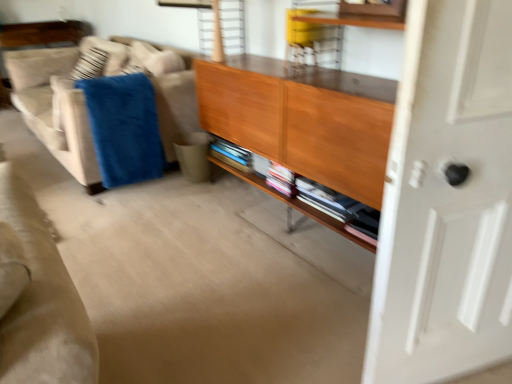
Question: From the image's perspective, does white glossy door at right appear lower than blue soft blanket at left?

Choices:
 (A) yes
 (B) no

Answer: (A)

Question: Could you tell me if white glossy door at right is facing blue soft blanket at left?

Choices:
 (A) no
 (B) yes

Answer: (A)

Question: Can you confirm if white glossy door at right is shorter than blue soft blanket at left?

Choices:
 (A) yes
 (B) no

Answer: (B)

Question: Does white glossy door at right appear on the left side of blue soft blanket at left?

Choices:
 (A) yes
 (B) no

Answer: (B)

Question: Is white glossy door at right surrounding blue soft blanket at left?

Choices:
 (A) no
 (B) yes

Answer: (A)

Question: Is white glossy door at right touching blue soft blanket at left?

Choices:
 (A) no
 (B) yes

Answer: (A)

Question: From a real-world perspective, does beige fabric couch at left stand above wooden shelf at center?

Choices:
 (A) yes
 (B) no

Answer: (A)

Question: Is beige fabric couch at left positioned beyond the bounds of wooden shelf at center?

Choices:
 (A) no
 (B) yes

Answer: (B)

Question: Considering the relative sizes of beige fabric couch at left and wooden shelf at center in the image provided, is beige fabric couch at left smaller than wooden shelf at center?

Choices:
 (A) no
 (B) yes

Answer: (A)

Question: Considering the relative sizes of beige fabric couch at left and wooden shelf at center in the image provided, is beige fabric couch at left thinner than wooden shelf at center?

Choices:
 (A) yes
 (B) no

Answer: (B)

Question: Is beige fabric couch at left touching wooden shelf at center?

Choices:
 (A) yes
 (B) no

Answer: (B)

Question: Is beige fabric couch at left bigger than wooden shelf at center?

Choices:
 (A) no
 (B) yes

Answer: (B)

Question: Is wooden shelf at center aimed at beige fabric couch at left?

Choices:
 (A) no
 (B) yes

Answer: (A)